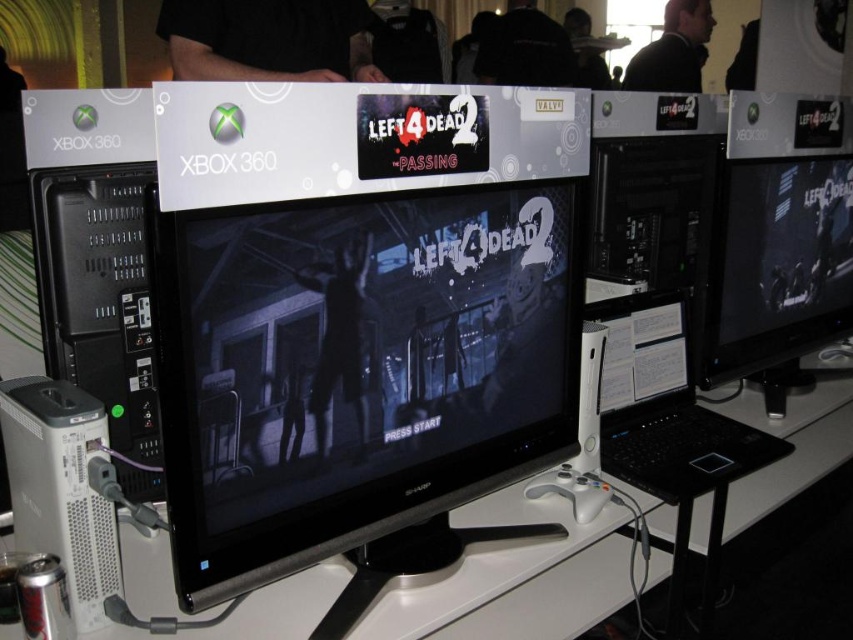
Question: Is black glossy monitor at center in front of matte black monitor at center?

Choices:
 (A) no
 (B) yes

Answer: (B)

Question: Which point is farther from the camera taking this photo?

Choices:
 (A) (808, 312)
 (B) (682, 330)

Answer: (A)

Question: Is black plastic computer at left to the left of black matte laptop at center from the viewer's perspective?

Choices:
 (A) yes
 (B) no

Answer: (A)

Question: Which of the following is the farthest from the observer?

Choices:
 (A) (490, 593)
 (B) (659, 387)
 (C) (64, 308)

Answer: (B)

Question: Does white plastic computer desk at center appear on the right side of black matte laptop at center?

Choices:
 (A) no
 (B) yes

Answer: (A)

Question: Which object is positioned closest to the black matte laptop at center?

Choices:
 (A) white plastic computer desk at center
 (B) matte black monitor at center
 (C) black plastic computer at left

Answer: (A)